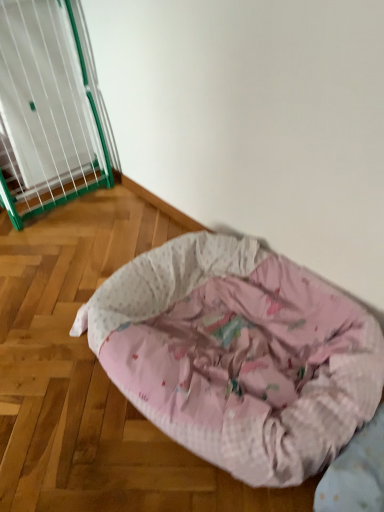
Where is `pink fabric dog bed at center`? The width and height of the screenshot is (384, 512). pink fabric dog bed at center is located at coordinates (238, 355).

This screenshot has height=512, width=384. What do you see at coordinates (238, 355) in the screenshot? I see `pink fabric dog bed at center` at bounding box center [238, 355].

At what (x,y) coordinates should I click in order to perform the action: click on pink fabric dog bed at center. Please return your answer as a coordinate pair (x, y). Looking at the image, I should click on (238, 355).